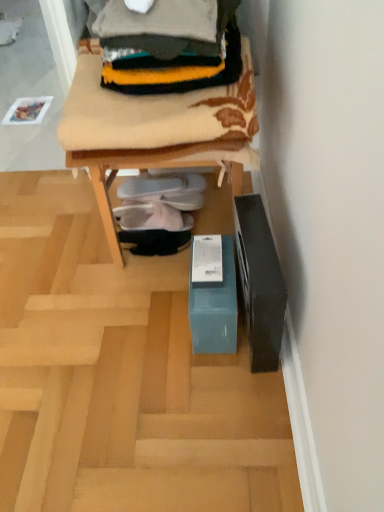
The height and width of the screenshot is (512, 384). What are the coordinates of `white fabric slipper at center, which is the first footwear from top to bottom` in the screenshot? It's located at (166, 190).

What do you see at coordinates (154, 242) in the screenshot?
I see `black suede shoes at center, the first footwear ordered from the bottom` at bounding box center [154, 242].

Based on the photo, measure the distance between point (162, 489) and camera.

Result: The depth of point (162, 489) is 97.30 centimeters.

Locate an element on the screen. The image size is (384, 512). white fabric shoe at center, arranged as the second footwear when ordered from the bottom is located at coordinates (150, 217).

Locate an element on the screen. knitted wool sweater at upper center is located at coordinates (169, 46).

The image size is (384, 512). Find the location of `white fabric slipper at center, which is the first footwear from top to bottom`. white fabric slipper at center, which is the first footwear from top to bottom is located at coordinates click(166, 190).

In terms of width, does teal cardboard box at lower center look wider or thinner when compared to knitted wool sweater at upper center?

In the image, teal cardboard box at lower center appears to be wider than knitted wool sweater at upper center.

Is point (120, 248) behind point (201, 32)?

Yes, point (120, 248) is behind point (201, 32).

Considering the sizes of teal cardboard box at lower center and black suede shoes at center, which is counted as the third footwear, starting from the top, in the image, is teal cardboard box at lower center taller or shorter than black suede shoes at center, which is counted as the third footwear, starting from the top,?

Considering their sizes, teal cardboard box at lower center has less height than black suede shoes at center, which is counted as the third footwear, starting from the top.

Does teal cardboard box at lower center come in front of black suede shoes at center, which is counted as the third footwear, starting from the top?

That is True.

From a real-world perspective, between teal cardboard box at lower center and black suede shoes at center, the first footwear ordered from the bottom, who is vertically lower?

From a 3D spatial view, teal cardboard box at lower center is below.

Based on the photo, which of these two, teal cardboard box at lower center or black suede shoes at center, the first footwear ordered from the bottom, is smaller?

With smaller size is black suede shoes at center, the first footwear ordered from the bottom.

From a real-world perspective, is teal cardboard box at lower center on white fabric slipper at center, which is the third footwear in bottom-to-top order?

Yes, from a real-world perspective, teal cardboard box at lower center is over white fabric slipper at center, which is the third footwear in bottom-to-top order

From the image's perspective, relative to white fabric slipper at center, which is the first footwear from top to bottom, is teal cardboard box at lower center above or below?

teal cardboard box at lower center is situated higher than white fabric slipper at center, which is the first footwear from top to bottom, in the image.

Is teal cardboard box at lower center bigger or smaller than white fabric slipper at center, which is the first footwear from top to bottom?

In the image, teal cardboard box at lower center appears to be larger than white fabric slipper at center, which is the first footwear from top to bottom.

Is point (214, 19) closer or farther from the camera than point (177, 243)?

Point (214, 19) is closer to the camera than point (177, 243).

Is knitted wool sweater at upper center looking in the opposite direction of black suede shoes at center, which is counted as the third footwear, starting from the top?

No, knitted wool sweater at upper center's orientation is not away from black suede shoes at center, which is counted as the third footwear, starting from the top.

From the image's perspective, is knitted wool sweater at upper center under black suede shoes at center, the first footwear ordered from the bottom?

Actually, knitted wool sweater at upper center appears above black suede shoes at center, the first footwear ordered from the bottom, in the image.

From a real-world perspective, is knitted wool sweater at upper center positioned above or below black suede shoes at center, the first footwear ordered from the bottom?

knitted wool sweater at upper center is situated higher than black suede shoes at center, the first footwear ordered from the bottom, in the real world.

Between white fabric slipper at center, which is the third footwear in bottom-to-top order, and black suede shoes at center, which is counted as the third footwear, starting from the top, which one appears on the left side from the viewer's perspective?

Positioned to the left is black suede shoes at center, which is counted as the third footwear, starting from the top.

Does white fabric slipper at center, which is the third footwear in bottom-to-top order, have a greater width compared to black suede shoes at center, which is counted as the third footwear, starting from the top?

Yes, white fabric slipper at center, which is the third footwear in bottom-to-top order, is wider than black suede shoes at center, which is counted as the third footwear, starting from the top.

How far apart are white fabric slipper at center, which is the third footwear in bottom-to-top order, and black suede shoes at center, the first footwear ordered from the bottom?

white fabric slipper at center, which is the third footwear in bottom-to-top order, and black suede shoes at center, the first footwear ordered from the bottom, are 5.85 inches apart.

Where is `the 2nd footwear located above the black suede shoes at center, which is counted as the third footwear, starting from the top (from a real-world perspective)`? the 2nd footwear located above the black suede shoes at center, which is counted as the third footwear, starting from the top (from a real-world perspective) is located at coordinates (166, 190).

From the image's perspective, is knitted wool sweater at upper center located beneath teal cardboard box at lower center?

No, from the image's perspective, knitted wool sweater at upper center is not beneath teal cardboard box at lower center.

Is knitted wool sweater at upper center bigger or smaller than teal cardboard box at lower center?

Considering their sizes, knitted wool sweater at upper center takes up less space than teal cardboard box at lower center.

Would you say knitted wool sweater at upper center is outside teal cardboard box at lower center?

That's incorrect, knitted wool sweater at upper center is not completely outside teal cardboard box at lower center.

Is point (170, 11) positioned behind point (135, 127)?

That is False.

Are knitted wool sweater at upper center and white fabric slipper at center, which is the third footwear in bottom-to-top order, making contact?

knitted wool sweater at upper center and white fabric slipper at center, which is the third footwear in bottom-to-top order, are clearly separated.

Based on the photo, is knitted wool sweater at upper center turned away from white fabric slipper at center, which is the third footwear in bottom-to-top order?

No, white fabric slipper at center, which is the third footwear in bottom-to-top order, is not at the back of knitted wool sweater at upper center.

Which of these two, knitted wool sweater at upper center or white fabric slipper at center, which is the third footwear in bottom-to-top order, stands taller?

With more height is knitted wool sweater at upper center.

From a real-world perspective, is knitted wool sweater at upper center below white fabric slipper at center, which is the third footwear in bottom-to-top order?

No, from a real-world perspective, knitted wool sweater at upper center is not beneath white fabric slipper at center, which is the third footwear in bottom-to-top order.

This screenshot has width=384, height=512. I want to click on furniture that is below the knitted wool sweater at upper center (from the image's perspective), so click(155, 130).

Where is `furnurniture directly beneath the black suede shoes at center, which is counted as the third footwear, starting from the top (from a real-world perspective)`? The width and height of the screenshot is (384, 512). furnurniture directly beneath the black suede shoes at center, which is counted as the third footwear, starting from the top (from a real-world perspective) is located at coordinates (121, 375).

Which object lies further to the anchor point teal cardboard box at lower center, teal cardboard box at lower center or black suede shoes at center, the first footwear ordered from the bottom?

The object further to teal cardboard box at lower center is teal cardboard box at lower center.

From the image, which object appears to be farther from knitted wool sweater at upper center, black suede shoes at center, which is counted as the third footwear, starting from the top, or white fabric shoe at center, the second footwear from the top?

black suede shoes at center, which is counted as the third footwear, starting from the top, lies further to knitted wool sweater at upper center than the other object.

Looking at this image, which object lies further to the anchor point black suede shoes at center, the first footwear ordered from the bottom, white fabric slipper at center, which is the third footwear in bottom-to-top order, or knitted wool sweater at upper center?

The object further to black suede shoes at center, the first footwear ordered from the bottom, is knitted wool sweater at upper center.

Which object lies nearer to the anchor point knitted wool sweater at upper center, black suede shoes at center, the first footwear ordered from the bottom, or teal cardboard box at lower center?

Among the two, black suede shoes at center, the first footwear ordered from the bottom, is located nearer to knitted wool sweater at upper center.

Looking at this image, based on their spatial positions, is teal cardboard box at lower center or white fabric shoe at center, arranged as the second footwear when ordered from the bottom, further from white fabric slipper at center, which is the third footwear in bottom-to-top order?

teal cardboard box at lower center is positioned further to the anchor white fabric slipper at center, which is the third footwear in bottom-to-top order.

Based on their spatial positions, is white fabric shoe at center, the second footwear from the top, or black suede shoes at center, the first footwear ordered from the bottom, closer to knitted wool sweater at upper center?

white fabric shoe at center, the second footwear from the top, lies closer to knitted wool sweater at upper center than the other object.

Looking at the image, which one is located further to teal cardboard box at lower center, knitted wool sweater at upper center or teal cardboard box at lower center?

teal cardboard box at lower center lies further to teal cardboard box at lower center than the other object.

Estimate the real-world distances between objects in this image. Which object is closer to knitted wool sweater at upper center, teal cardboard box at lower center or teal cardboard box at lower center?

Based on the image, teal cardboard box at lower center appears to be nearer to knitted wool sweater at upper center.

Find the location of a particular element. The height and width of the screenshot is (512, 384). clothing between teal cardboard box at lower center and white fabric slipper at center, which is the third footwear in bottom-to-top order, from front to back is located at coordinates (169, 46).

I want to click on furnurniture between teal cardboard box at lower center and black suede shoes at center, which is counted as the third footwear, starting from the top, from front to back, so click(121, 375).

Find the location of a particular element. This screenshot has height=512, width=384. footwear between white fabric slipper at center, which is the first footwear from top to bottom, and black suede shoes at center, which is counted as the third footwear, starting from the top, from top to bottom is located at coordinates (150, 217).

The image size is (384, 512). Identify the location of footwear located between teal cardboard box at lower center and white fabric shoe at center, the second footwear from the top, in the depth direction. (154, 242).